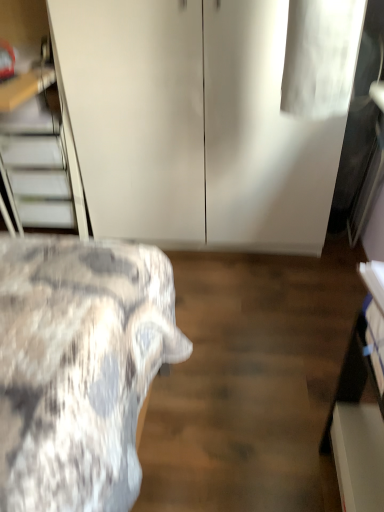
What do you see at coordinates (209, 116) in the screenshot?
I see `white matte cabinet at center` at bounding box center [209, 116].

Measure the distance between white matte cabinet at center and camera.

A distance of 4.28 feet exists between white matte cabinet at center and camera.

In order to click on white matte cabinet at center in this screenshot , I will do `click(209, 116)`.

This screenshot has height=512, width=384. What do you see at coordinates (39, 167) in the screenshot?
I see `metallic silver stairs at left` at bounding box center [39, 167].

This screenshot has width=384, height=512. I want to click on metallic silver stairs at left, so click(x=39, y=167).

Find the location of `white matte cabinet at center`. white matte cabinet at center is located at coordinates (209, 116).

Between metallic silver stairs at left and white matte cabinet at center, which one appears on the left side from the viewer's perspective?

metallic silver stairs at left is more to the left.

Which object is closer to the camera, metallic silver stairs at left or white matte cabinet at center?

white matte cabinet at center.

Is point (53, 227) in front of point (261, 103)?

That is False.

From the image's perspective, is metallic silver stairs at left on white matte cabinet at center?

Actually, metallic silver stairs at left appears below white matte cabinet at center in the image.

From a real-world perspective, is metallic silver stairs at left under white matte cabinet at center?

Yes, from a real-world perspective, metallic silver stairs at left is beneath white matte cabinet at center.

Considering the sizes of objects metallic silver stairs at left and white matte cabinet at center in the image provided, who is wider, metallic silver stairs at left or white matte cabinet at center?

white matte cabinet at center.

Considering the relative sizes of metallic silver stairs at left and white matte cabinet at center in the image provided, is metallic silver stairs at left taller than white matte cabinet at center?

No, metallic silver stairs at left is not taller than white matte cabinet at center.

Is metallic silver stairs at left bigger than white matte cabinet at center?

Incorrect, metallic silver stairs at left is not larger than white matte cabinet at center.

Is white matte cabinet at center a part of metallic silver stairs at left?

No, white matte cabinet at center is not surrounded by metallic silver stairs at left.

Are metallic silver stairs at left and white matte cabinet at center located far from each other?

No.

Is metallic silver stairs at left oriented towards white matte cabinet at center?

No, metallic silver stairs at left does not turn towards white matte cabinet at center.

How many degrees apart are the facing directions of metallic silver stairs at left and white matte cabinet at center?

metallic silver stairs at left and white matte cabinet at center are facing 0.000346 degrees away from each other.

Measure the distance from metallic silver stairs at left to white matte cabinet at center.

37.26 centimeters.

Image resolution: width=384 pixels, height=512 pixels. I want to click on stairwell located underneath the white matte cabinet at center (from a real-world perspective), so click(x=39, y=167).

Considering the relative positions of white matte cabinet at center and metallic silver stairs at left in the image provided, is white matte cabinet at center to the right of metallic silver stairs at left from the viewer's perspective?

Correct, you'll find white matte cabinet at center to the right of metallic silver stairs at left.

Is white matte cabinet at center positioned behind metallic silver stairs at left?

No, it is in front of metallic silver stairs at left.

Which is closer, (188, 21) or (53, 138)?

The point (188, 21) is more forward.

Looking at this image, from the image's perspective, does white matte cabinet at center appear higher than metallic silver stairs at left?

Correct, white matte cabinet at center appears higher than metallic silver stairs at left in the image.

From a real-world perspective, which object rests below the other?

metallic silver stairs at left is physically lower.

Considering the sizes of objects white matte cabinet at center and metallic silver stairs at left in the image provided, who is wider, white matte cabinet at center or metallic silver stairs at left?

white matte cabinet at center.

Is white matte cabinet at center taller than metallic silver stairs at left?

Yes.

Which of these two, white matte cabinet at center or metallic silver stairs at left, is bigger?

white matte cabinet at center.

Does white matte cabinet at center contain metallic silver stairs at left?

Actually, metallic silver stairs at left is outside white matte cabinet at center.

Is there a large distance between white matte cabinet at center and metallic silver stairs at left?

No, white matte cabinet at center is in close proximity to metallic silver stairs at left.

Is white matte cabinet at center facing away from metallic silver stairs at left?

No, white matte cabinet at center is not facing the opposite direction of metallic silver stairs at left.

How many degrees apart are the facing directions of white matte cabinet at center and metallic silver stairs at left?

The angular difference between white matte cabinet at center and metallic silver stairs at left is 0.000346 degrees.

Identify the location of stairwell on the left of white matte cabinet at center. The height and width of the screenshot is (512, 384). (39, 167).

Where is `dresser above the metallic silver stairs at left (from a real-world perspective)`? Image resolution: width=384 pixels, height=512 pixels. dresser above the metallic silver stairs at left (from a real-world perspective) is located at coordinates (209, 116).

Locate an element on the screen. The image size is (384, 512). dresser above the metallic silver stairs at left (from the image's perspective) is located at coordinates (209, 116).